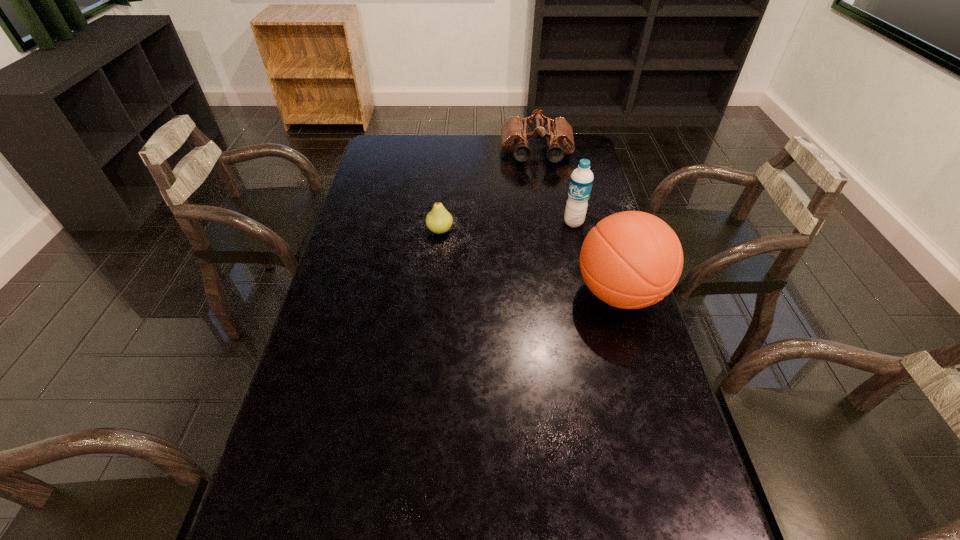
Find the location of a particular element. free space at the far left corner is located at coordinates (393, 160).

The width and height of the screenshot is (960, 540). In the image, there is a desktop. What are the coordinates of `vacant region at the far right corner` in the screenshot? It's located at (571, 158).

The height and width of the screenshot is (540, 960). Identify the location of vacant space in between the water bottle and the leftmost object. (507, 227).

Where is `free spot between the basketball and the leftmost object`? This screenshot has width=960, height=540. free spot between the basketball and the leftmost object is located at coordinates (530, 262).

Identify the location of free space between the farthest object and the water bottle. (555, 188).

Identify the location of blank region between the water bottle and the farthest object. (555, 188).

Locate an element on the screen. The image size is (960, 540). free space that is in between the leftmost object and the binoculars is located at coordinates (489, 192).

Locate an element on the screen. The width and height of the screenshot is (960, 540). the second closest object relative to the water bottle is located at coordinates (515, 135).

Where is `object that is the nearest to the farthest object`? object that is the nearest to the farthest object is located at coordinates (581, 180).

You are a GUI agent. You are given a task and a screenshot of the screen. Output one action in this format:
    pyautogui.click(x=<x>, y=<y>)
    Task: Click on the vacant space that satisfies the following two spatial constraints: 1. on the front side of the basketball; 2. on the left side of the water bottle
    This screenshot has height=540, width=960.
    Given the screenshot: What is the action you would take?
    pyautogui.click(x=589, y=293)